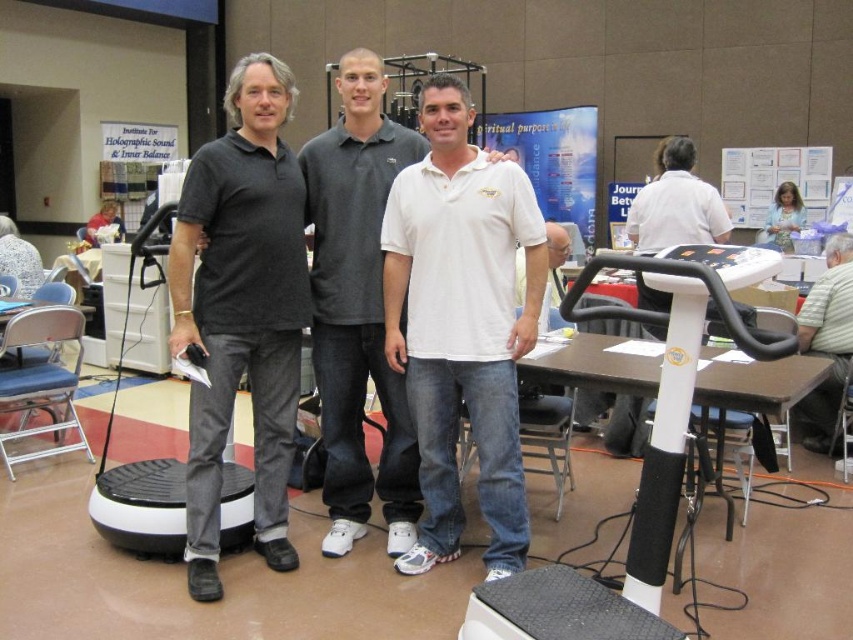
You are standing in the convention hall and want to find the white matte shirt at center. Based on the coordinates provided, where should you look relative to the neutral wall in the background?

The white matte shirt at center is located at coordinates point 0.483 on the x axis and 0.420 on the y axis, so you should look slightly to the right of the center horizontally and a bit below the center vertically relative to the neutral wall in the background.

You are standing in the large hall and want to locate the white matte shirt at center. According to the coordinates provided, where should you look relative to the neutral wall in the background?

The white matte shirt at center is located at coordinates point (357, 308), which means it is positioned near the center of the image, slightly to the right and a bit below the top of the neutral wall in the background.

You are at an event and want to approach the person wearing the white cotton polo shirt at center and the gray striped shirt at lower right. Which person should you walk towards first if you want to greet them in order from closest to farthest?

You should first approach the white cotton polo shirt at center because it is closer to the viewer than the gray striped shirt at lower right.